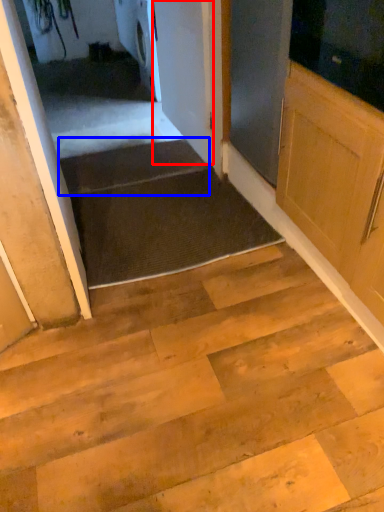
Question: Which point is further to the camera, door (highlighted by a red box) or stairs (highlighted by a blue box)?

Choices:
 (A) door
 (B) stairs

Answer: (B)